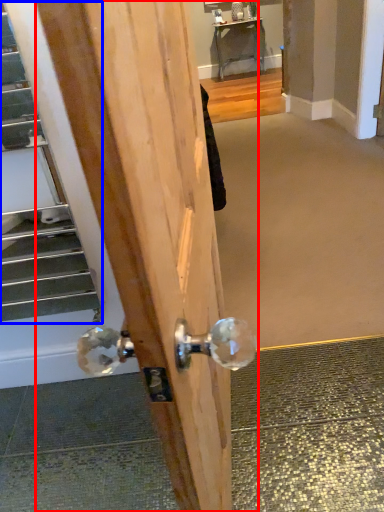
Question: Which object is closer to the camera taking this photo, door (highlighted by a red box) or escalator (highlighted by a blue box)?

Choices:
 (A) door
 (B) escalator

Answer: (A)